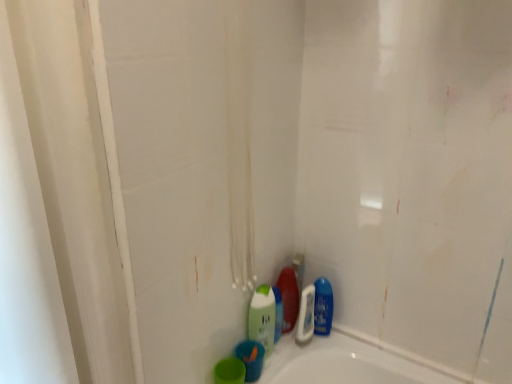
Question: Would you say shiny plastic bottle at lower center, which is the 2th cleaning product in left-to-right order, is a long distance from blue glossy bottle at lower right, which appears as the third cleaning product when viewed from the left?

Choices:
 (A) yes
 (B) no

Answer: (B)

Question: Is shiny plastic bottle at lower center, which is the 2th cleaning product in left-to-right order, to the left of blue glossy bottle at lower right, the 1th cleaning product viewed from the right, from the viewer's perspective?

Choices:
 (A) no
 (B) yes

Answer: (B)

Question: Does shiny plastic bottle at lower center, the second cleaning product viewed from the right, have a greater width compared to blue glossy bottle at lower right, which appears as the third cleaning product when viewed from the left?

Choices:
 (A) yes
 (B) no

Answer: (A)

Question: Considering the relative positions of shiny plastic bottle at lower center, the second cleaning product viewed from the right, and blue glossy bottle at lower right, which appears as the third cleaning product when viewed from the left, in the image provided, is shiny plastic bottle at lower center, the second cleaning product viewed from the right, behind blue glossy bottle at lower right, which appears as the third cleaning product when viewed from the left,?

Choices:
 (A) no
 (B) yes

Answer: (B)

Question: Considering the relative sizes of shiny plastic bottle at lower center, which is the 2th cleaning product in left-to-right order, and blue glossy bottle at lower right, the 1th cleaning product viewed from the right, in the image provided, is shiny plastic bottle at lower center, which is the 2th cleaning product in left-to-right order, shorter than blue glossy bottle at lower right, the 1th cleaning product viewed from the right,?

Choices:
 (A) no
 (B) yes

Answer: (A)

Question: Looking at their shapes, would you say blue matte bottle at lower center, arranged as the 2th mouthwash when viewed from the back, is wider or thinner than blue glossy bottle at lower right, the 1th cleaning product viewed from the right?

Choices:
 (A) wide
 (B) thin

Answer: (A)

Question: Is blue matte bottle at lower center, the 2th mouthwash when ordered from front to back, inside or outside of blue glossy bottle at lower right, which appears as the third cleaning product when viewed from the left?

Choices:
 (A) outside
 (B) inside

Answer: (A)

Question: Considering the relative positions of blue matte bottle at lower center, the second mouthwash from the left, and blue glossy bottle at lower right, which appears as the third cleaning product when viewed from the left, in the image provided, is blue matte bottle at lower center, the second mouthwash from the left, to the left or to the right of blue glossy bottle at lower right, which appears as the third cleaning product when viewed from the left,?

Choices:
 (A) left
 (B) right

Answer: (A)

Question: Is blue matte bottle at lower center, arranged as the 2th mouthwash when viewed from the back, taller or shorter than blue glossy bottle at lower right, the 1th cleaning product viewed from the right?

Choices:
 (A) tall
 (B) short

Answer: (B)

Question: From the image's perspective, is shiny plastic bottle at lower center, the second cleaning product viewed from the right, positioned above or below green matte cup at lower center, which appears as the 1th mouthwash when viewed from the front?

Choices:
 (A) above
 (B) below

Answer: (A)

Question: Relative to green matte cup at lower center, marked as the first mouthwash in a left-to-right arrangement, is shiny plastic bottle at lower center, the second cleaning product viewed from the right, in front or behind?

Choices:
 (A) front
 (B) behind

Answer: (B)

Question: In terms of size, does shiny plastic bottle at lower center, the second cleaning product viewed from the right, appear bigger or smaller than green matte cup at lower center, the third mouthwash from the right?

Choices:
 (A) small
 (B) big

Answer: (B)

Question: Visually, is shiny plastic bottle at lower center, which is the 2th cleaning product in left-to-right order, positioned to the left or to the right of green matte cup at lower center, which is the 3th mouthwash in back-to-front order?

Choices:
 (A) left
 (B) right

Answer: (B)

Question: Is shiny plastic bottle at lower center, the second cleaning product viewed from the right, in front of or behind blue glossy bottle at lower right, which appears as the third cleaning product when viewed from the left, in the image?

Choices:
 (A) behind
 (B) front

Answer: (A)

Question: Would you say shiny plastic bottle at lower center, which is the 2th cleaning product in left-to-right order, is to the left or to the right of blue glossy bottle at lower right, the 1th cleaning product viewed from the right, in the picture?

Choices:
 (A) left
 (B) right

Answer: (A)